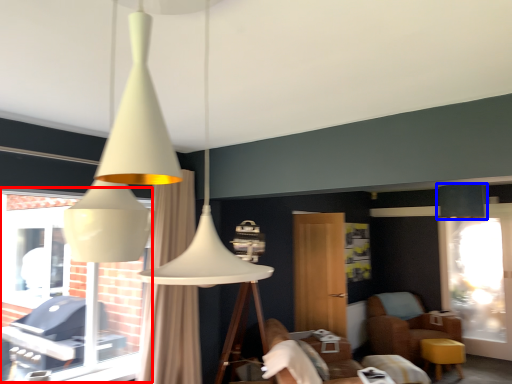
Question: Which point is closer to the camera, bay window (highlighted by a red box) or lamp (highlighted by a blue box)?

Choices:
 (A) bay window
 (B) lamp

Answer: (A)